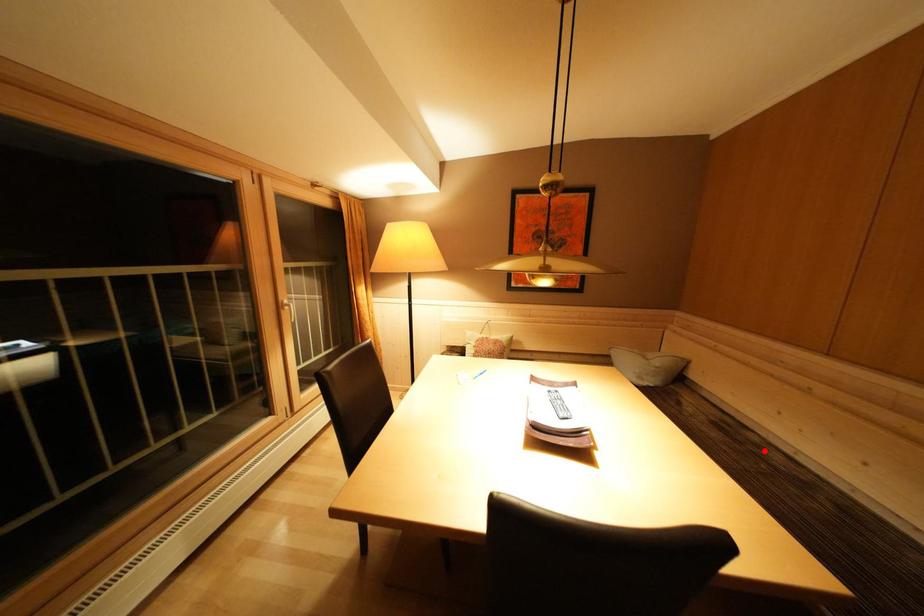
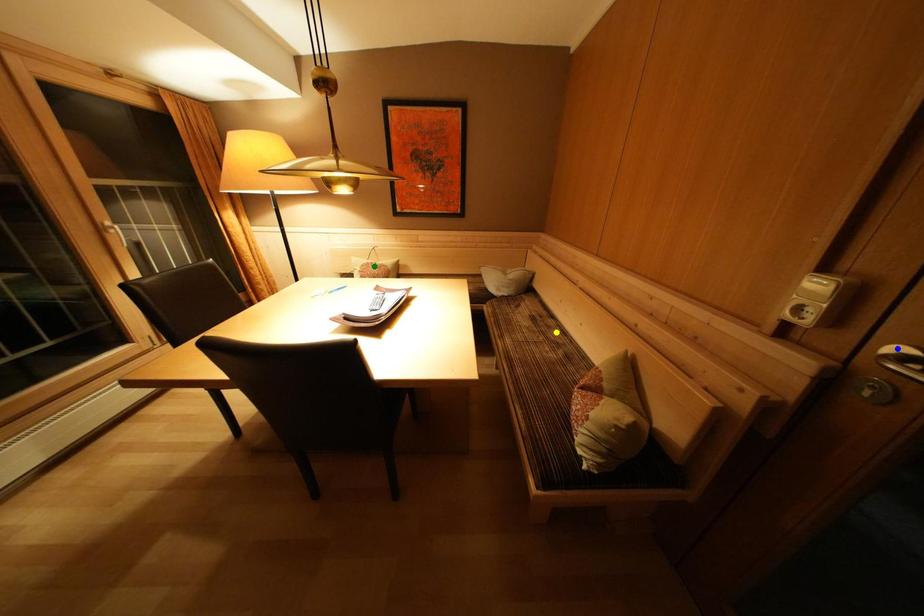
Question: I am providing you with two images of the same scene from different viewpoints. A red point is marked on the first image. You are given multiple points on the second image. Which point in image 2 is actually the same real-world point as the red point in image 1?

Choices:
 (A) yellow point
 (B) blue point
 (C) green point

Answer: (A)